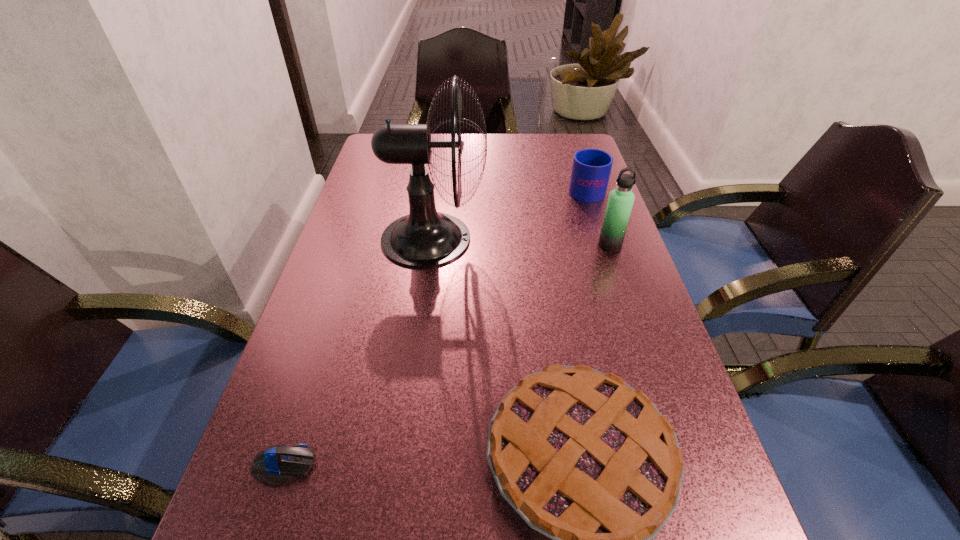
This screenshot has height=540, width=960. What are the coordinates of `the tallest object` in the screenshot? It's located at (425, 238).

I want to click on thermos bottle, so click(620, 202).

Where is `the third shortest object`? The image size is (960, 540). the third shortest object is located at coordinates (591, 168).

Identify the location of the farthest object. This screenshot has height=540, width=960. (591, 168).

The height and width of the screenshot is (540, 960). What are the coordinates of `the leftmost object` in the screenshot? It's located at (277, 465).

This screenshot has height=540, width=960. I want to click on computer mouse, so click(x=277, y=465).

Locate an element on the screen. vacant space located 0.240m on the front-facing side of the fan is located at coordinates (579, 239).

Identify the location of vacant area located on the left of the fourth shortest object. This screenshot has height=540, width=960. (536, 245).

Locate an element on the screen. This screenshot has width=960, height=540. blank area located on the side with the handle of the third tallest object is located at coordinates (568, 134).

Where is `vacant space located on the side with the handle of the third tallest object`? The width and height of the screenshot is (960, 540). vacant space located on the side with the handle of the third tallest object is located at coordinates (572, 147).